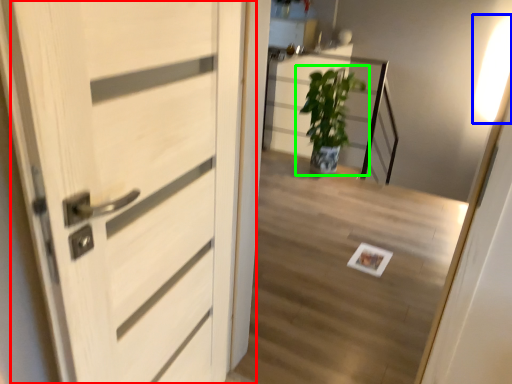
Question: Which object is the farthest from door (highlighted by a red box)? Choose among these: light (highlighted by a blue box) or houseplant (highlighted by a green box).

Choices:
 (A) light
 (B) houseplant

Answer: (A)